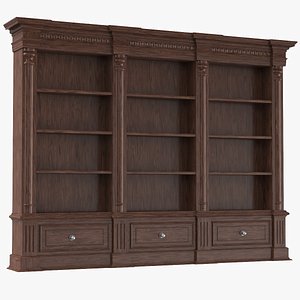
At what (x,y) coordinates should I click in order to perform the action: click on shelf. Please return your answer as a coordinate pair (x, y). The height and width of the screenshot is (300, 300). Looking at the image, I should click on (73, 171), (163, 173), (242, 173), (239, 134), (241, 100), (158, 95), (71, 91), (70, 132), (161, 133).